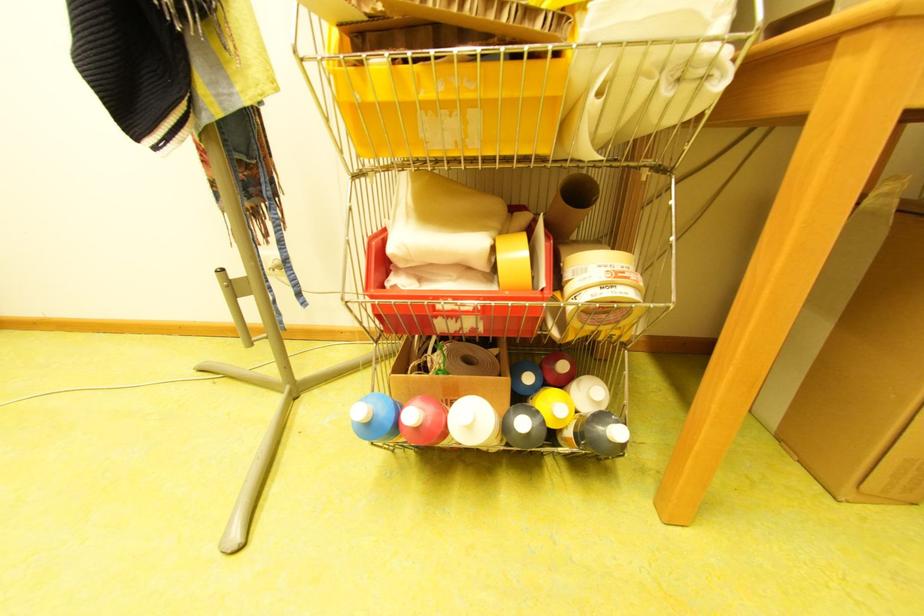
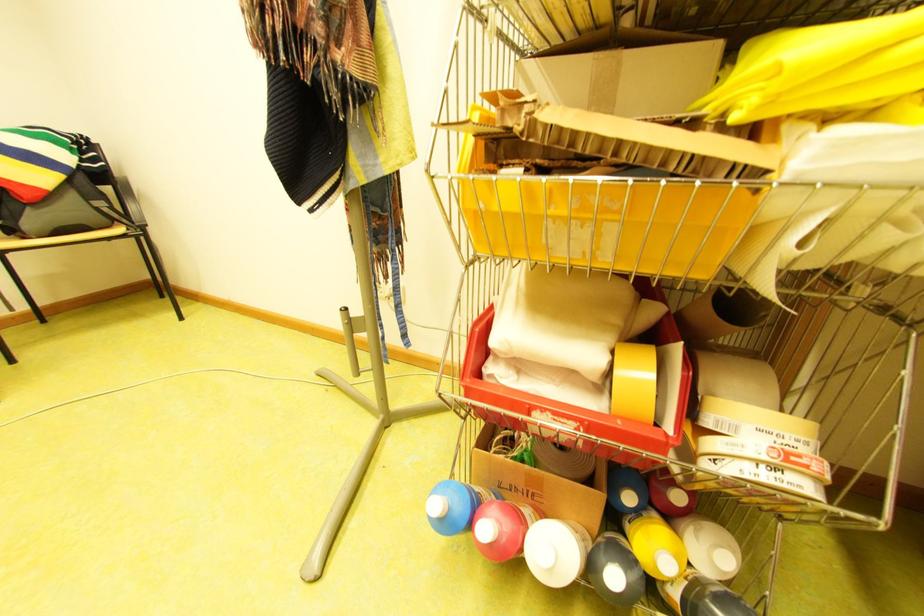
Find the pixel in the second image that matches (x=548, y=390) in the first image.

(649, 513)